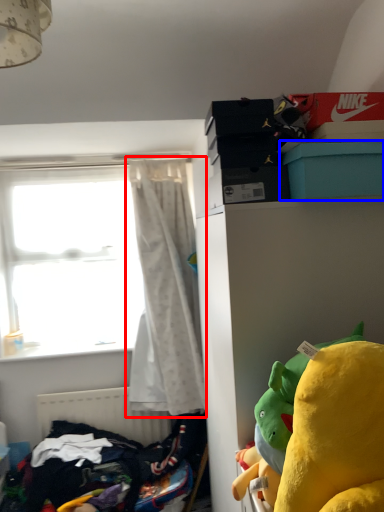
Question: Which point is further to the camera, curtain (highlighted by a red box) or box (highlighted by a blue box)?

Choices:
 (A) curtain
 (B) box

Answer: (A)